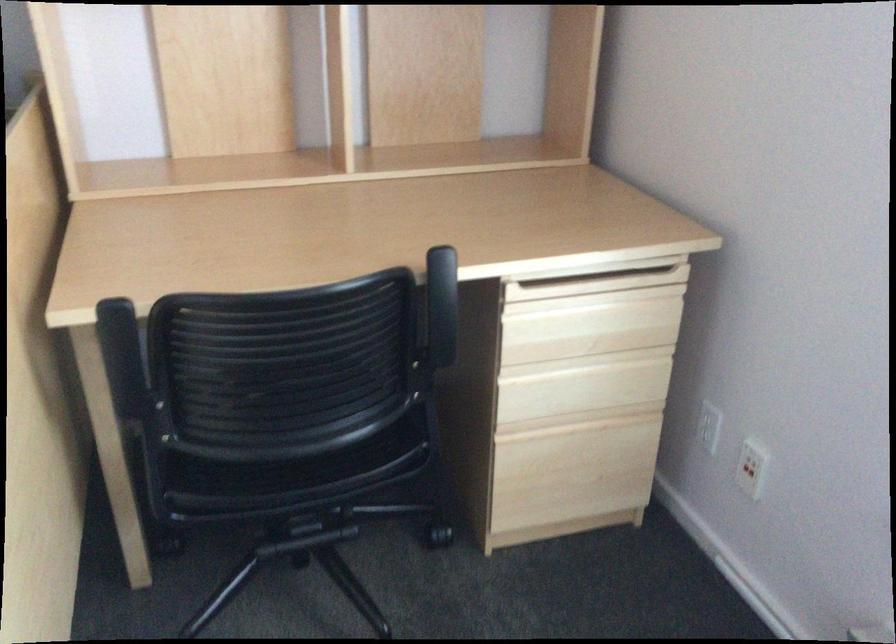
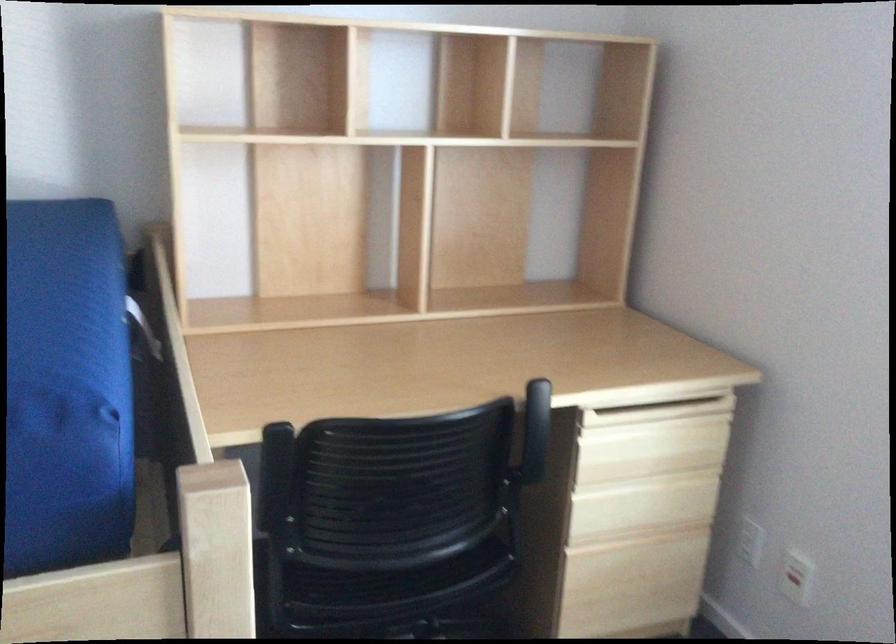
Locate, in the second image, the point that corresponds to [438,290] in the first image.

(536, 417)